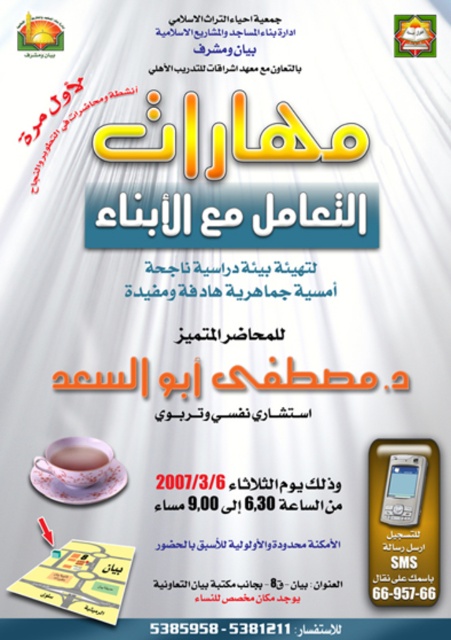
Can you confirm if pink porcelain teacup at lower left is wider than matte plastic smartphone at center?

Yes, pink porcelain teacup at lower left is wider than matte plastic smartphone at center.

Where is `pink porcelain teacup at lower left`? The width and height of the screenshot is (451, 640). pink porcelain teacup at lower left is located at coordinates (77, 460).

Find the location of a particular element. pink porcelain teacup at lower left is located at coordinates pos(77,460).

Which of these two, matte plastic smartphone at center or matte porcelain cup at center, stands taller?

matte plastic smartphone at center

Is matte plastic smartphone at center behind matte porcelain cup at center?

No, matte plastic smartphone at center is closer to the viewer.

Find the location of a particular element. The height and width of the screenshot is (640, 451). matte plastic smartphone at center is located at coordinates (404, 490).

Who is more distant from viewer, (381, 456) or (76, 477)?

Positioned behind is point (381, 456).

Can you confirm if metallic silver phone at bottom right is positioned below pink porcelain teacup at lower left?

Correct, metallic silver phone at bottom right is located below pink porcelain teacup at lower left.

At what (x,y) coordinates should I click in order to perform the action: click on metallic silver phone at bottom right. Please return your answer as a coordinate pair (x, y). Looking at the image, I should click on (404, 522).

Find the location of a particular element. The width and height of the screenshot is (451, 640). metallic silver phone at bottom right is located at coordinates (404, 522).